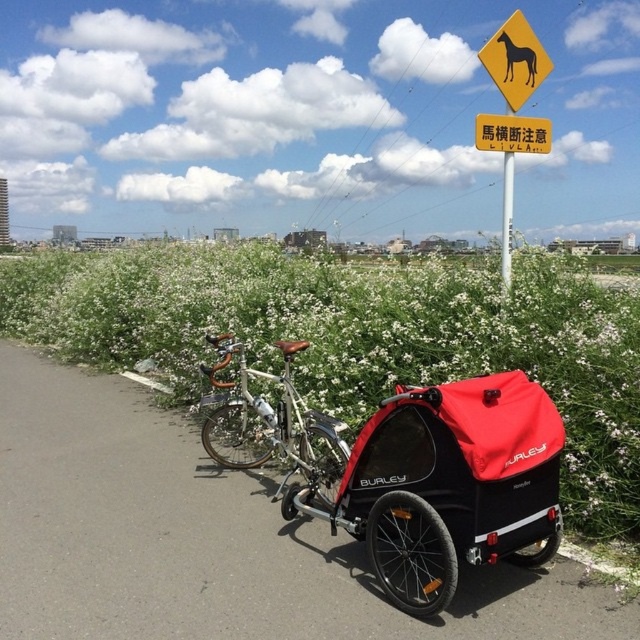
Which is in front, point (518, 54) or point (509, 54)?

Point (509, 54) is in front.

Can you confirm if yellow plastic horse at upper center is positioned above black plastic horse at upper center?

Correct, yellow plastic horse at upper center is located above black plastic horse at upper center.

Between point (516, 106) and point (525, 49), which one is positioned behind?

Point (516, 106)

At what (x,y) coordinates should I click in order to perform the action: click on yellow plastic horse at upper center. Please return your answer as a coordinate pair (x, y). This screenshot has height=640, width=640. Looking at the image, I should click on (515, 60).

Based on the photo, who is taller, black matte bicycle at center or white plastic pole at center?

black matte bicycle at center

What do you see at coordinates (362, 337) in the screenshot? I see `black matte bicycle at center` at bounding box center [362, 337].

Image resolution: width=640 pixels, height=640 pixels. I want to click on black matte bicycle at center, so click(362, 337).

Is silver metallic bicycle at center positioned before black plastic horse at upper center?

Yes.

Does point (257, 461) come behind point (528, 64)?

Yes, it is behind point (528, 64).

Locate an element on the screen. The width and height of the screenshot is (640, 640). silver metallic bicycle at center is located at coordinates (273, 428).